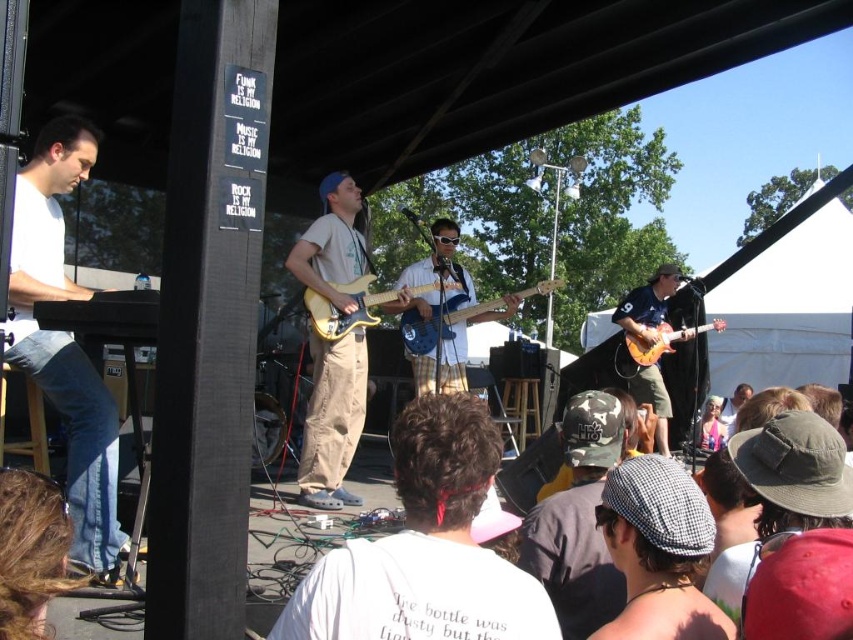
Does white cotton t-shirt at center appear on the right side of checkered fabric cap at lower center?

Incorrect, white cotton t-shirt at center is not on the right side of checkered fabric cap at lower center.

Can you confirm if white cotton t-shirt at center is positioned below checkered fabric cap at lower center?

No, white cotton t-shirt at center is not below checkered fabric cap at lower center.

Identify the location of white cotton t-shirt at center. (425, 547).

You are a GUI agent. You are given a task and a screenshot of the screen. Output one action in this format:
    pyautogui.click(x=<x>, y=<y>)
    Task: Click on the white cotton t-shirt at center
    The width and height of the screenshot is (853, 640).
    Given the screenshot: What is the action you would take?
    pyautogui.click(x=425, y=547)

Between white cotton t-shirt at center and shiny orange electric guitar at center, which one appears on the right side from the viewer's perspective?

Positioned to the right is shiny orange electric guitar at center.

Who is more forward, (426, 445) or (625, 333)?

Point (426, 445) is in front.

In order to click on white cotton t-shirt at center in this screenshot , I will do coord(425,547).

Is point (305, 257) positioned before point (582, 556)?

No, (305, 257) is further to viewer.

Can you confirm if matte yellow guitar at center is thinner than camo hat at center?

No, matte yellow guitar at center is not thinner than camo hat at center.

Does point (347, 440) come behind point (624, 426)?

Yes, point (347, 440) is behind point (624, 426).

You are a GUI agent. You are given a task and a screenshot of the screen. Output one action in this format:
    pyautogui.click(x=<x>, y=<y>)
    Task: Click on the matte yellow guitar at center
    This screenshot has width=853, height=640.
    Given the screenshot: What is the action you would take?
    pyautogui.click(x=332, y=420)